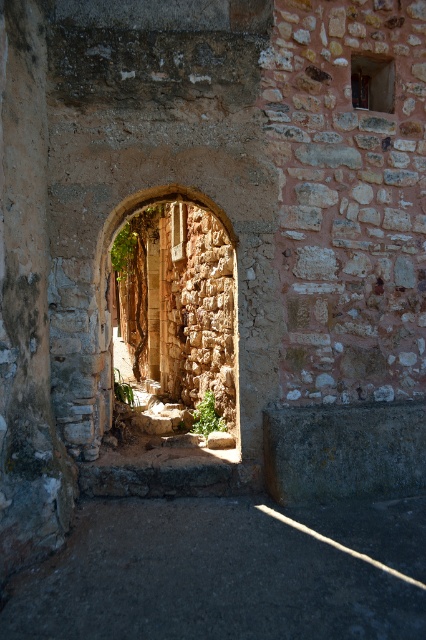
You are standing at the entrance of the rustic stone archway. You need to place a decorative stone statue exactly at the center of the dark stone floor at lower center. According to the coordinates provided, where should you place the statue?

The dark stone floor at lower center is located at coordinates point (x=227, y=573), so you should place the decorative stone statue at that exact point to center it.

You are standing at the entrance of the rustic stone archway and see the point marked at coordinates (227,573). According to the image description, what is the location of this point relative to the dark stone floor at lower center?

The point at coordinates (227,573) is located on the dark stone floor at lower center as indicated in the description.

You are standing in front of the rustic stone archway at center and want to step onto the dark stone floor at lower center. Which direction should you move to reach the floor?

You should move forward towards the dark stone floor at lower center because it is closer to you than the rustic stone archway at center.